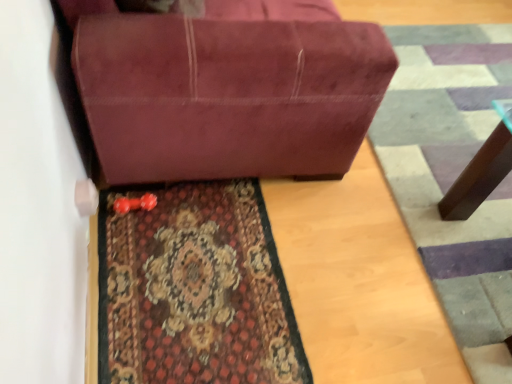
What do you see at coordinates (453, 176) in the screenshot? This screenshot has height=384, width=512. I see `carpeted doormat at lower right` at bounding box center [453, 176].

Measure the distance between suede-like maroon couch at center and camera.

The distance of suede-like maroon couch at center from camera is 1.09 meters.

Find the location of a particular element. carpeted doormat at lower right is located at coordinates (453, 176).

Is there a large distance between carpeted rug at lower center and carpeted doormat at lower right?

No.

How different are the orientations of carpeted rug at lower center and carpeted doormat at lower right in degrees?

carpeted rug at lower center and carpeted doormat at lower right are facing 178 degrees away from each other.

Do you think carpeted rug at lower center is within carpeted doormat at lower right, or outside of it?

carpeted rug at lower center is located beyond the bounds of carpeted doormat at lower right.

Does carpeted rug at lower center lie behind carpeted doormat at lower right?

No, carpeted rug at lower center is closer to the viewer.

Does carpeted doormat at lower right have a lesser height compared to carpeted rug at lower center?

In fact, carpeted doormat at lower right may be taller than carpeted rug at lower center.

Which is correct: carpeted doormat at lower right is inside carpeted rug at lower center, or outside of it?

carpeted doormat at lower right is not enclosed by carpeted rug at lower center.

Which object is more forward, carpeted doormat at lower right or carpeted rug at lower center?

carpeted rug at lower center is more forward.

Does carpeted doormat at lower right appear on the right side of carpeted rug at lower center?

Correct, you'll find carpeted doormat at lower right to the right of carpeted rug at lower center.

Does suede-like maroon couch at center lie behind carpeted rug at lower center?

No.

Who is shorter, suede-like maroon couch at center or carpeted rug at lower center?

carpeted rug at lower center is shorter.

Can you confirm if suede-like maroon couch at center is wider than carpeted rug at lower center?

Yes, suede-like maroon couch at center is wider than carpeted rug at lower center.

Which of these two, carpeted rug at lower center or suede-like maroon couch at center, is smaller?

With smaller size is carpeted rug at lower center.

Is carpeted rug at lower center oriented away from suede-like maroon couch at center?

No, carpeted rug at lower center is not facing the opposite direction of suede-like maroon couch at center.

Which is more to the right, carpeted rug at lower center or suede-like maroon couch at center?

Positioned to the right is suede-like maroon couch at center.

From a real-world perspective, who is located lower, suede-like maroon couch at center or carpeted doormat at lower right?

From a 3D spatial view, carpeted doormat at lower right is below.

Can you tell me how much suede-like maroon couch at center and carpeted doormat at lower right differ in facing direction?

The angle between the facing direction of suede-like maroon couch at center and the facing direction of carpeted doormat at lower right is 179 degrees.

From the image's perspective, which one is positioned higher, suede-like maroon couch at center or carpeted doormat at lower right?

suede-like maroon couch at center is shown above in the image.

Is carpeted doormat at lower right not within suede-like maroon couch at center?

Absolutely, carpeted doormat at lower right is external to suede-like maroon couch at center.

Which is in front, carpeted doormat at lower right or suede-like maroon couch at center?

Positioned in front is suede-like maroon couch at center.

This screenshot has width=512, height=384. What are the coordinates of `studio couch above the carpeted doormat at lower right (from a real-world perspective)` in the screenshot? It's located at (226, 87).

Can you confirm if carpeted doormat at lower right is taller than suede-like maroon couch at center?

No.

The width and height of the screenshot is (512, 384). In order to click on mat in front of the carpeted doormat at lower right in this screenshot , I will do `click(194, 289)`.

Identify the location of doormat behind the carpeted rug at lower center. The width and height of the screenshot is (512, 384). (453, 176).

Consider the image. From the image, which object appears to be farther from carpeted doormat at lower right, carpeted rug at lower center or suede-like maroon couch at center?

carpeted rug at lower center.

When comparing their distances from suede-like maroon couch at center, does carpeted doormat at lower right or carpeted rug at lower center seem closer?

carpeted rug at lower center is closer to suede-like maroon couch at center.

When comparing their distances from carpeted doormat at lower right, does suede-like maroon couch at center or carpeted rug at lower center seem further?

carpeted rug at lower center is positioned further to the anchor carpeted doormat at lower right.

Estimate the real-world distances between objects in this image. Which object is closer to carpeted rug at lower center, carpeted doormat at lower right or suede-like maroon couch at center?

suede-like maroon couch at center lies closer to carpeted rug at lower center than the other object.

Which object lies further to the anchor point carpeted rug at lower center, suede-like maroon couch at center or carpeted doormat at lower right?

The object further to carpeted rug at lower center is carpeted doormat at lower right.

Based on their spatial positions, is carpeted rug at lower center or carpeted doormat at lower right closer to suede-like maroon couch at center?

The object closer to suede-like maroon couch at center is carpeted rug at lower center.

This screenshot has height=384, width=512. Identify the location of studio couch between carpeted rug at lower center and carpeted doormat at lower right from left to right. (226, 87).